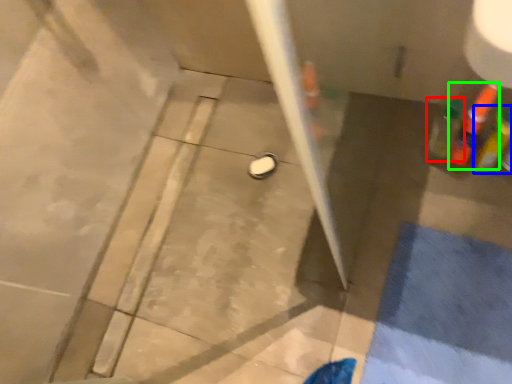
Question: Which object is the closest to the bottle (highlighted by a red box)? Choose among these: bottle (highlighted by a blue box) or bottle (highlighted by a green box).

Choices:
 (A) bottle
 (B) bottle

Answer: (B)